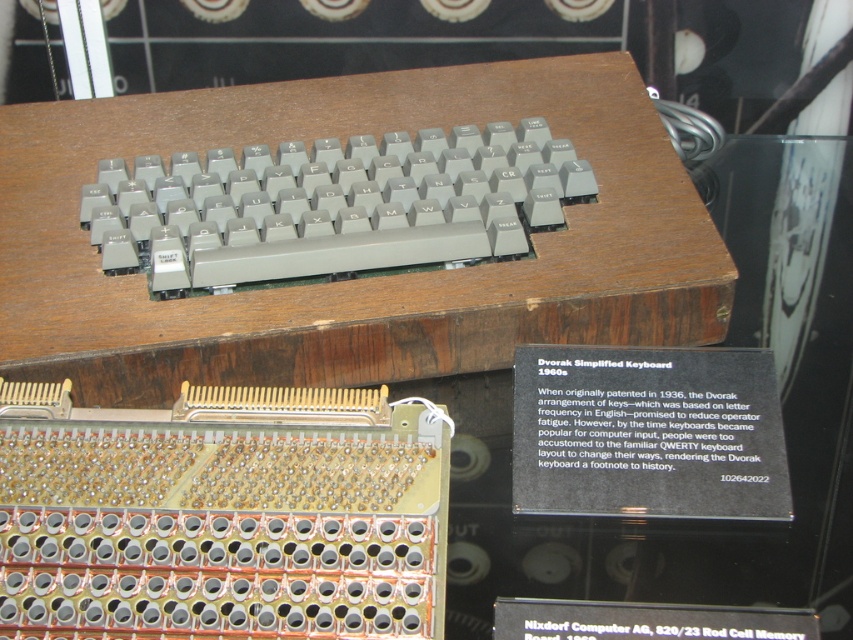
You are standing in front of the vintage Dvorak keyboard display. There are two points marked on the display. The first point is at coordinates point (10, 237) and the second point is at point (265, 196). If you were to walk towards the display, which point would appear closer to you?

Point (10, 237) is in front of point (265, 196), so it would appear closer to you when you walk towards the display.

You are a museum curator trying to place a 2.5 inch wide decorative plaque between the wooden table at center and the gray plastic keyboard at upper center. Will the plaque fit in the space between them?

The wooden table at center and gray plastic keyboard at upper center are 2.40 inches apart from each other. Since the plaque is 2.5 inches wide, it is slightly wider than the available space. The plaque will not fit between them without overlapping either object.

In the scene shown: You are setting up a display about vintage keyboards. You have a wooden table at center and a gray plastic keyboard at upper center. Where should you place the keyboard to match the scene?

The gray plastic keyboard at upper center should be placed above the wooden table at center, as the wooden table at center is below the gray plastic keyboard at upper center in the scene.